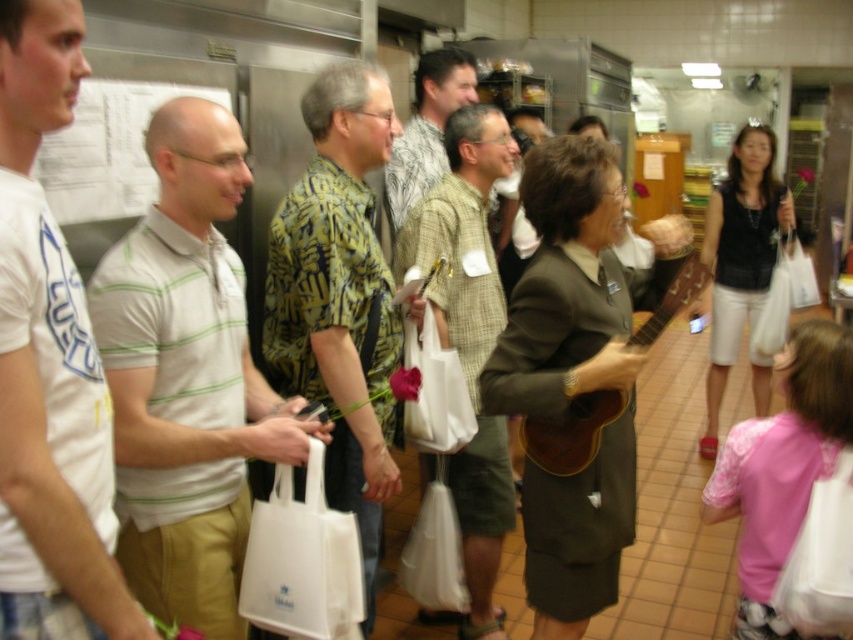
Question: Can you confirm if white cotton t-shirt at left is positioned to the right of checkered fabric shirt at center?

Choices:
 (A) yes
 (B) no

Answer: (B)

Question: Where is white cotton t-shirt at left located in relation to printed fabric shirt at center in the image?

Choices:
 (A) right
 (B) left

Answer: (B)

Question: Does white cotton t-shirt at left appear on the right side of printed fabric shirt at center?

Choices:
 (A) yes
 (B) no

Answer: (B)

Question: Which point is farther to the camera?

Choices:
 (A) white striped polo shirt at left
 (B) printed fabric shirt at center
 (C) checkered fabric shirt at center
 (D) white cotton t-shirt at left

Answer: (C)

Question: Considering the real-world distances, which object is farthest from the checkered fabric shirt at center?

Choices:
 (A) printed fabric shirt at center
 (B) white striped polo shirt at left

Answer: (B)

Question: Among these objects, which one is nearest to the camera?

Choices:
 (A) printed fabric shirt at center
 (B) white striped polo shirt at left

Answer: (B)